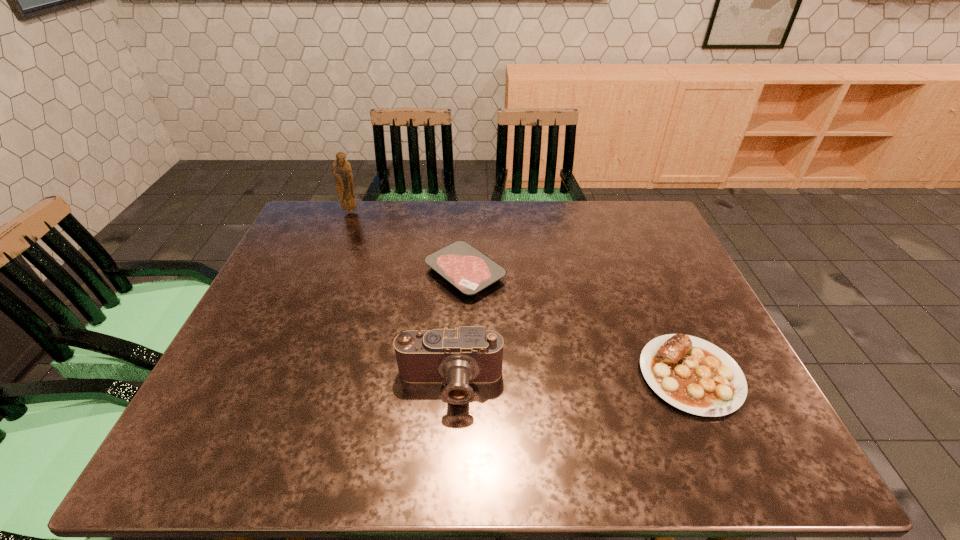
Where is `vacant area that lies between the camera and the tallest object`? The height and width of the screenshot is (540, 960). vacant area that lies between the camera and the tallest object is located at coordinates (400, 298).

You are a GUI agent. You are given a task and a screenshot of the screen. Output one action in this format:
    pyautogui.click(x=<x>, y=<y>)
    Task: Click on the free spot between the taller steak and the camera
    Image resolution: width=960 pixels, height=540 pixels.
    Given the screenshot: What is the action you would take?
    pyautogui.click(x=570, y=380)

Identify the location of unoccupied area between the tallest object and the taller steak. (520, 293).

This screenshot has height=540, width=960. What are the coordinates of `free spot between the figurine and the shorter steak` in the screenshot? It's located at (408, 242).

You are a GUI agent. You are given a task and a screenshot of the screen. Output one action in this format:
    pyautogui.click(x=<x>, y=<y>)
    Task: Click on the vacant region between the farthest object and the right steak
    
    Given the screenshot: What is the action you would take?
    pyautogui.click(x=520, y=293)

The image size is (960, 540). I want to click on free area in between the leftmost object and the third tallest object, so click(520, 293).

Identify the location of free spot between the third tallest object and the third shortest object. (570, 380).

Where is `free space between the figurine and the second tallest object`? The image size is (960, 540). free space between the figurine and the second tallest object is located at coordinates (400, 298).

Locate an element on the screen. The height and width of the screenshot is (540, 960). the second closest object to the right steak is located at coordinates (469, 270).

Identify which object is located as the nearest to the camera. Please provide its 2D coordinates. Your answer should be formatted as a tuple, i.e. [(x, y)], where the tuple contains the x and y coordinates of a point satisfying the conditions above.

[(469, 270)]